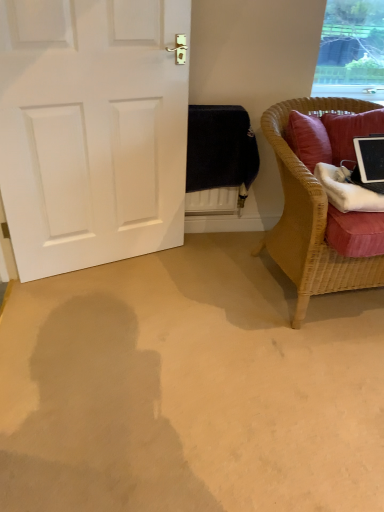
Question: Can you confirm if white matte door at left is taller than woven wicker chair at right?

Choices:
 (A) yes
 (B) no

Answer: (A)

Question: Is white matte door at left further to camera compared to woven wicker chair at right?

Choices:
 (A) yes
 (B) no

Answer: (A)

Question: Can you confirm if white matte door at left is shorter than woven wicker chair at right?

Choices:
 (A) no
 (B) yes

Answer: (A)

Question: Is white matte door at left not within woven wicker chair at right?

Choices:
 (A) no
 (B) yes

Answer: (B)

Question: From the image's perspective, is white matte door at left located beneath woven wicker chair at right?

Choices:
 (A) yes
 (B) no

Answer: (B)

Question: In terms of height, does woven wicker chair at right look taller or shorter compared to transparent glass window at upper right?

Choices:
 (A) short
 (B) tall

Answer: (B)

Question: From the image's perspective, is woven wicker chair at right located above or below transparent glass window at upper right?

Choices:
 (A) below
 (B) above

Answer: (A)

Question: Relative to transparent glass window at upper right, is woven wicker chair at right in front or behind?

Choices:
 (A) behind
 (B) front

Answer: (B)

Question: From a real-world perspective, is woven wicker chair at right positioned above or below transparent glass window at upper right?

Choices:
 (A) above
 (B) below

Answer: (B)

Question: Is black glossy tablet at right wider or thinner than woven wicker chair at right?

Choices:
 (A) thin
 (B) wide

Answer: (A)

Question: In terms of height, does black glossy tablet at right look taller or shorter compared to woven wicker chair at right?

Choices:
 (A) tall
 (B) short

Answer: (B)

Question: Is point (370, 186) closer or farther from the camera than point (266, 121)?

Choices:
 (A) closer
 (B) farther

Answer: (A)

Question: From the image's perspective, is black glossy tablet at right positioned above or below woven wicker chair at right?

Choices:
 (A) below
 (B) above

Answer: (B)

Question: Based on their sizes in the image, would you say white matte door at left is bigger or smaller than transparent glass window at upper right?

Choices:
 (A) big
 (B) small

Answer: (A)

Question: Is point (115, 135) closer or farther from the camera than point (312, 86)?

Choices:
 (A) closer
 (B) farther

Answer: (A)